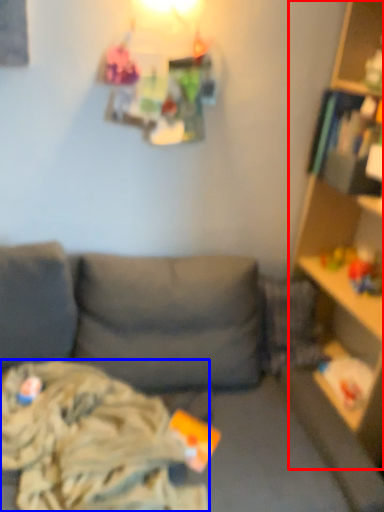
Question: Which object appears closest to the camera in this image, shelf (highlighted by a red box) or clothing (highlighted by a blue box)?

Choices:
 (A) shelf
 (B) clothing

Answer: (A)